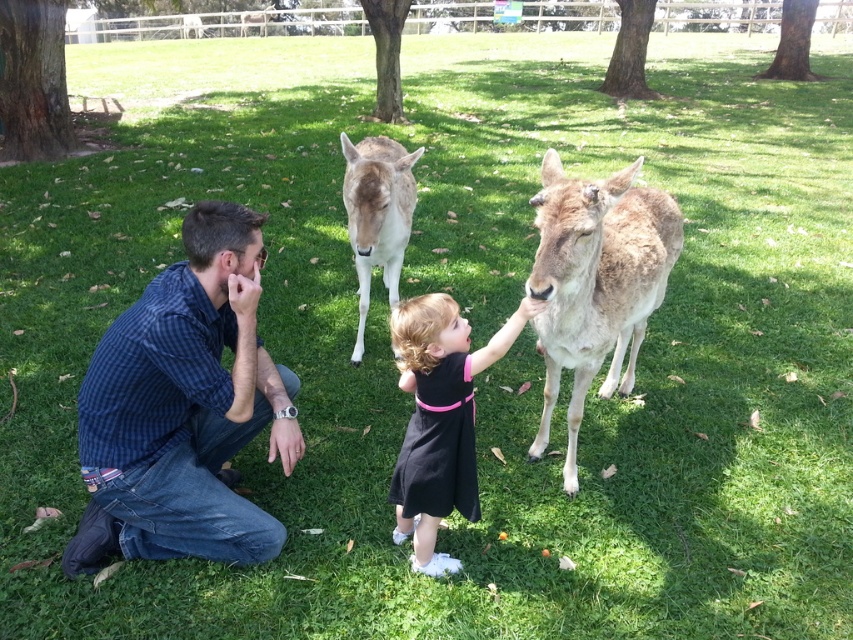
Question: Does blue checkered shirt at left have a lesser width compared to light brown fur at center?

Choices:
 (A) no
 (B) yes

Answer: (A)

Question: Among these objects, which one is farthest from the camera?

Choices:
 (A) brown fur deer at center
 (B) light brown fur at center
 (C) black matte dress at center

Answer: (B)

Question: Considering the real-world distances, which object is closest to the blue checkered shirt at left?

Choices:
 (A) light brown fur at center
 (B) brown fur deer at center
 (C) black matte dress at center

Answer: (C)

Question: Is brown fur deer at center positioned at the back of light brown fur at center?

Choices:
 (A) no
 (B) yes

Answer: (A)

Question: Can you confirm if blue checkered shirt at left is bigger than brown fur deer at center?

Choices:
 (A) no
 (B) yes

Answer: (A)

Question: Which object appears closest to the camera in this image?

Choices:
 (A) light brown fur at center
 (B) blue checkered shirt at left

Answer: (B)